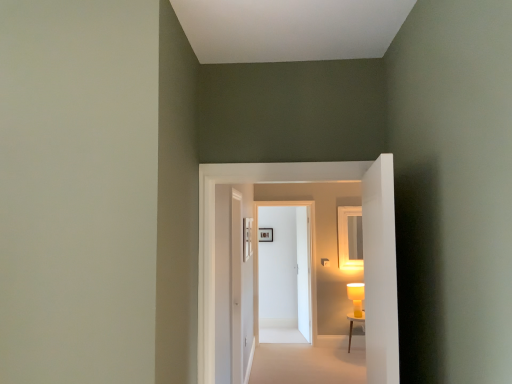
Question: Is white wooden table at lower right positioned behind matte black picture frame at center?

Choices:
 (A) no
 (B) yes

Answer: (A)

Question: Is white wooden table at lower right completely or partially outside of matte black picture frame at center?

Choices:
 (A) no
 (B) yes

Answer: (B)

Question: From a real-world perspective, is white wooden table at lower right located beneath matte black picture frame at center?

Choices:
 (A) yes
 (B) no

Answer: (A)

Question: Is matte black picture frame at center located within white wooden table at lower right?

Choices:
 (A) yes
 (B) no

Answer: (B)

Question: Is white wooden table at lower right touching matte black picture frame at center?

Choices:
 (A) no
 (B) yes

Answer: (A)

Question: Can you confirm if white wooden table at lower right is positioned to the left of matte black picture frame at center?

Choices:
 (A) yes
 (B) no

Answer: (B)

Question: Considering the relative sizes of beige carpet at center and matte yellow table lamp at right in the image provided, is beige carpet at center wider than matte yellow table lamp at right?

Choices:
 (A) yes
 (B) no

Answer: (A)

Question: Is matte yellow table lamp at right at the back of beige carpet at center?

Choices:
 (A) yes
 (B) no

Answer: (B)

Question: From a real-world perspective, is beige carpet at center over matte yellow table lamp at right?

Choices:
 (A) yes
 (B) no

Answer: (B)

Question: Is beige carpet at center taller than matte yellow table lamp at right?

Choices:
 (A) yes
 (B) no

Answer: (B)

Question: Does beige carpet at center appear on the left side of matte yellow table lamp at right?

Choices:
 (A) no
 (B) yes

Answer: (B)

Question: Can you confirm if beige carpet at center is smaller than matte yellow table lamp at right?

Choices:
 (A) yes
 (B) no

Answer: (B)

Question: Considering the relative positions of white glossy door at center, the third door when ordered from back to front, and matte yellow table lamp at right in the image provided, is white glossy door at center, the third door when ordered from back to front, in front of matte yellow table lamp at right?

Choices:
 (A) no
 (B) yes

Answer: (B)